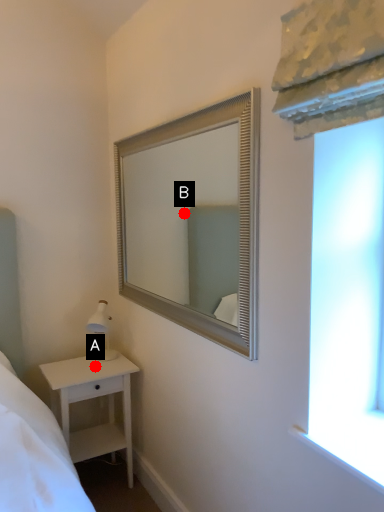
Question: Two points are circled on the image, labeled by A and B beside each circle. Which point appears farthest from the camera in this image?

Choices:
 (A) A is further
 (B) B is further

Answer: (B)